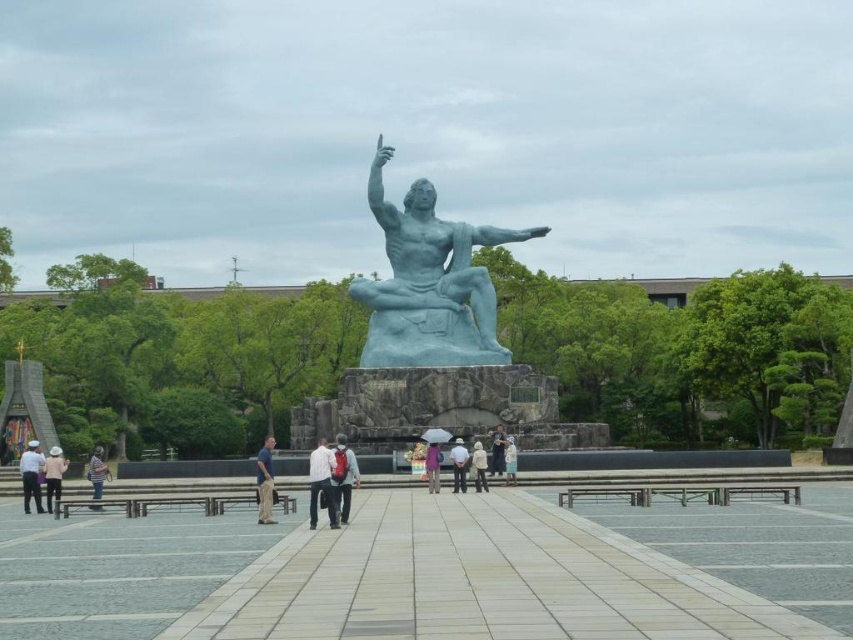
Question: Which point is farther to the camera?

Choices:
 (A) white matte shirt at center
 (B) blue stone statue at center

Answer: (B)

Question: Is blue polished stone statue at center to the right of light blue statue at center from the viewer's perspective?

Choices:
 (A) yes
 (B) no

Answer: (B)

Question: Which of these objects is positioned farthest from the light brown wooden bench at lower left?

Choices:
 (A) blue fabric pants at center
 (B) matte blue statue at center
 (C) purple fabric umbrella at center

Answer: (B)

Question: Which of the following is the closest to the observer?

Choices:
 (A) blue stone statue at center
 (B) white hat at lower left

Answer: (B)

Question: Can you confirm if white matte shirt at center is smaller than blue stone statue at center?

Choices:
 (A) no
 (B) yes

Answer: (A)

Question: Considering the relative positions of white matte shirt at center and light blue statue at center in the image provided, where is white matte shirt at center located with respect to light blue statue at center?

Choices:
 (A) below
 (B) above

Answer: (A)